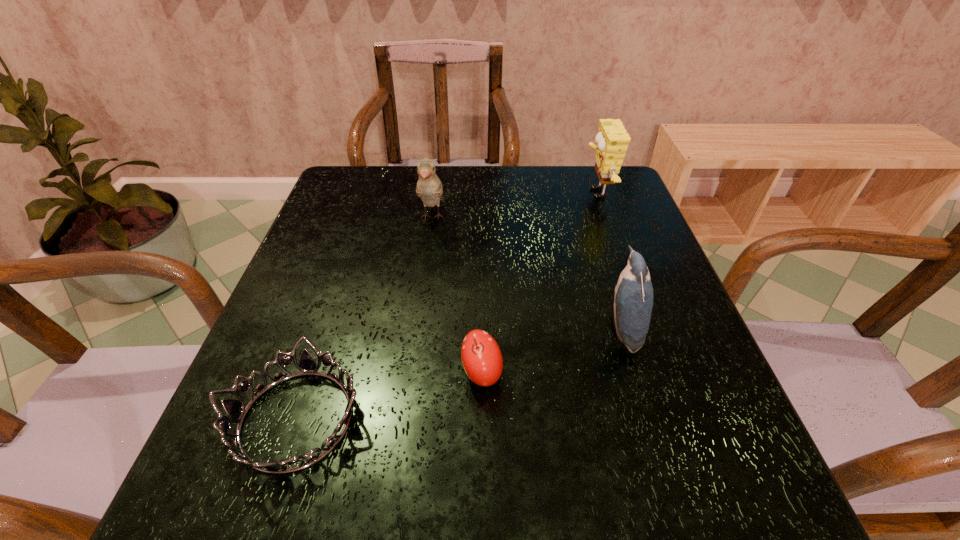
The height and width of the screenshot is (540, 960). I want to click on sponge, so click(612, 140).

At what (x,y) coordinates should I click in order to perform the action: click on the left bird. Please return your answer as a coordinate pair (x, y). The image size is (960, 540). Looking at the image, I should click on (429, 187).

At what (x,y) coordinates should I click in order to perform the action: click on the second object from left to right. Please return your answer as a coordinate pair (x, y). Looking at the image, I should click on (429, 187).

Identify the location of the right bird. (633, 302).

At what (x,y) coordinates should I click in order to perform the action: click on apple. Please return your answer as a coordinate pair (x, y). This screenshot has height=540, width=960. Looking at the image, I should click on (481, 357).

At what (x,y) coordinates should I click in order to perform the action: click on the third object from right to left. Please return your answer as a coordinate pair (x, y). This screenshot has width=960, height=540. Looking at the image, I should click on (481, 357).

Where is `tiara`? Image resolution: width=960 pixels, height=540 pixels. tiara is located at coordinates (235, 409).

At what (x,y) coordinates should I click in order to perform the action: click on the shortest object. Please return your answer as a coordinate pair (x, y). The image size is (960, 540). Looking at the image, I should click on (235, 409).

The image size is (960, 540). Identify the location of vacant space located on the front-facing side of the sponge. (462, 193).

Identify the location of vacant space located on the front-facing side of the sponge. (499, 193).